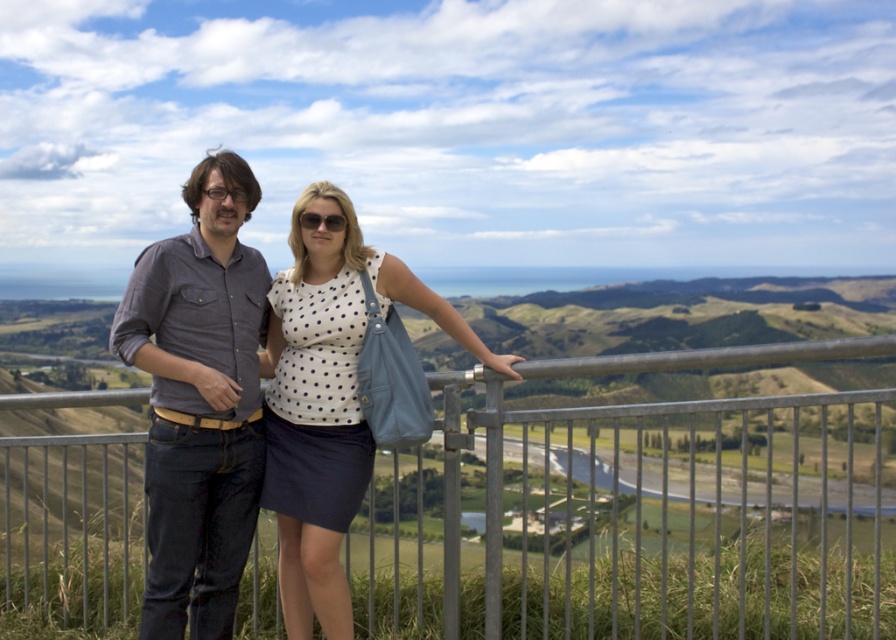
Question: Where is metallic gray fence at center located in relation to dark gray shirt at center in the image?

Choices:
 (A) left
 (B) right

Answer: (B)

Question: Can you confirm if metallic gray fence at center is positioned to the left of white dotted fabric at center?

Choices:
 (A) yes
 (B) no

Answer: (B)

Question: Which point appears farthest from the camera in this image?

Choices:
 (A) (291, 490)
 (B) (256, 406)

Answer: (B)

Question: Does metallic gray fence at center lie behind dark gray shirt at center?

Choices:
 (A) yes
 (B) no

Answer: (B)

Question: Which is nearer to the white dotted fabric at center?

Choices:
 (A) metallic gray fence at center
 (B) dark gray shirt at center

Answer: (B)

Question: Which point is farther to the camera?

Choices:
 (A) (329, 216)
 (B) (195, 614)
 (C) (253, 552)

Answer: (C)